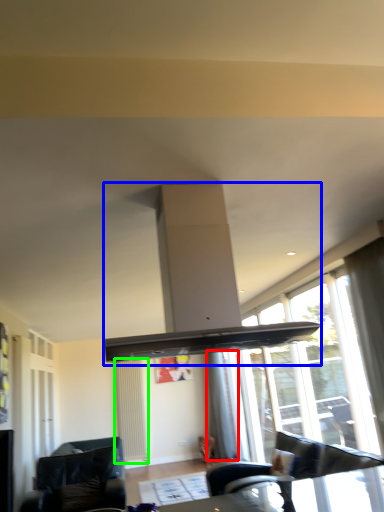
Question: Based on their relative distances, which object is nearer to curtain (highlighted by a red box)? Choose from exhaust hood (highlighted by a blue box) and radiator (highlighted by a green box).

Choices:
 (A) exhaust hood
 (B) radiator

Answer: (B)